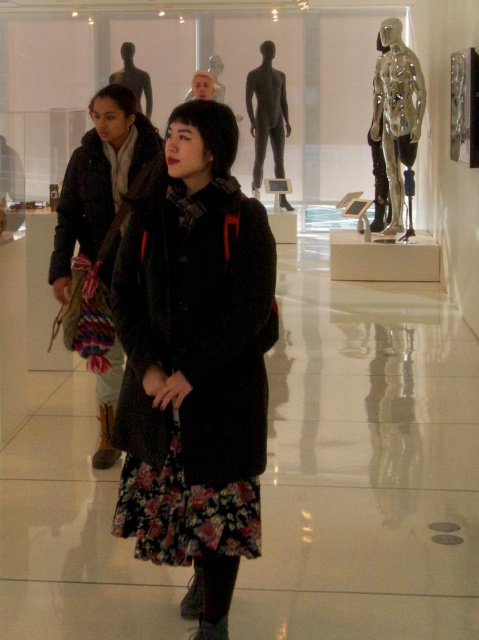
Question: Which object is positioned closest to the floral skirt at center?

Choices:
 (A) matte black mannequin at center
 (B) shiny metallic mannequin at upper right
 (C) matte black coat at center
 (D) matte black mannequin at upper center

Answer: (C)

Question: Which object appears closest to the camera in this image?

Choices:
 (A) matte black mannequin at center
 (B) matte black mannequin at upper center
 (C) matte black coat at center
 (D) shiny metallic mannequin at upper right

Answer: (C)

Question: Does matte black coat at center come behind shiny metallic mannequin at upper right?

Choices:
 (A) yes
 (B) no

Answer: (B)

Question: Does floral skirt at center appear on the right side of shiny metallic mannequin at upper right?

Choices:
 (A) yes
 (B) no

Answer: (B)

Question: Which point is closer to the camera?

Choices:
 (A) floral skirt at center
 (B) matte black mannequin at upper center
 (C) shiny metallic mannequin at upper right
 (D) matte black mannequin at center

Answer: (A)

Question: From the image, what is the correct spatial relationship of matte black coat at center in relation to matte black mannequin at center?

Choices:
 (A) right
 (B) left

Answer: (B)